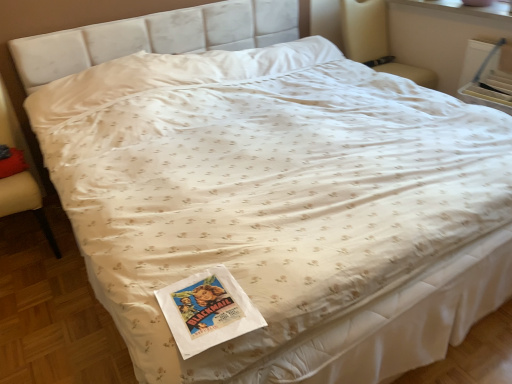
Question: Is beige fabric armchair at upper right, marked as the 2th armchair in a front-to-back arrangement, positioned in front of velvet beige armchair at left, arranged as the 2th armchair when viewed from the top?

Choices:
 (A) yes
 (B) no

Answer: (B)

Question: Does beige fabric armchair at upper right, marked as the 1th armchair in a back-to-front arrangement, have a greater width compared to velvet beige armchair at left, the first armchair when ordered from bottom to top?

Choices:
 (A) no
 (B) yes

Answer: (B)

Question: From the image's perspective, is beige fabric armchair at upper right, the first armchair from the top, beneath velvet beige armchair at left, the first armchair from the left?

Choices:
 (A) no
 (B) yes

Answer: (A)

Question: Is beige fabric armchair at upper right, which is the 2th armchair from left to right, thinner than velvet beige armchair at left, marked as the second armchair in a back-to-front arrangement?

Choices:
 (A) yes
 (B) no

Answer: (B)

Question: Considering the relative sizes of beige fabric armchair at upper right, marked as the 1th armchair in a back-to-front arrangement, and velvet beige armchair at left, the first armchair from the left, in the image provided, is beige fabric armchair at upper right, marked as the 1th armchair in a back-to-front arrangement, taller than velvet beige armchair at left, the first armchair from the left,?

Choices:
 (A) yes
 (B) no

Answer: (B)

Question: From a real-world perspective, is beige fabric armchair at upper right, marked as the 1th armchair in a back-to-front arrangement, positioned under velvet beige armchair at left, the first armchair from the left, based on gravity?

Choices:
 (A) yes
 (B) no

Answer: (B)

Question: From the image's perspective, is red cotton pillow at lower left above velvet beige armchair at left, the first armchair when ordered from bottom to top?

Choices:
 (A) no
 (B) yes

Answer: (B)

Question: Considering the relative positions of red cotton pillow at lower left and velvet beige armchair at left, marked as the second armchair in a back-to-front arrangement, in the image provided, is red cotton pillow at lower left to the right of velvet beige armchair at left, marked as the second armchair in a back-to-front arrangement, from the viewer's perspective?

Choices:
 (A) yes
 (B) no

Answer: (A)

Question: Does red cotton pillow at lower left have a greater height compared to velvet beige armchair at left, positioned as the second armchair in right-to-left order?

Choices:
 (A) yes
 (B) no

Answer: (B)

Question: Are red cotton pillow at lower left and velvet beige armchair at left, arranged as the 2th armchair when viewed from the top, beside each other?

Choices:
 (A) yes
 (B) no

Answer: (B)

Question: Is velvet beige armchair at left, marked as the second armchair in a back-to-front arrangement, surrounded by red cotton pillow at lower left?

Choices:
 (A) no
 (B) yes

Answer: (A)

Question: Considering the relative positions of red cotton pillow at lower left and velvet beige armchair at left, the first armchair when ordered from bottom to top, in the image provided, is red cotton pillow at lower left behind velvet beige armchair at left, the first armchair when ordered from bottom to top,?

Choices:
 (A) no
 (B) yes

Answer: (B)

Question: From the image's perspective, is velvet beige armchair at left, marked as the second armchair in a back-to-front arrangement, above red cotton pillow at lower left?

Choices:
 (A) yes
 (B) no

Answer: (B)